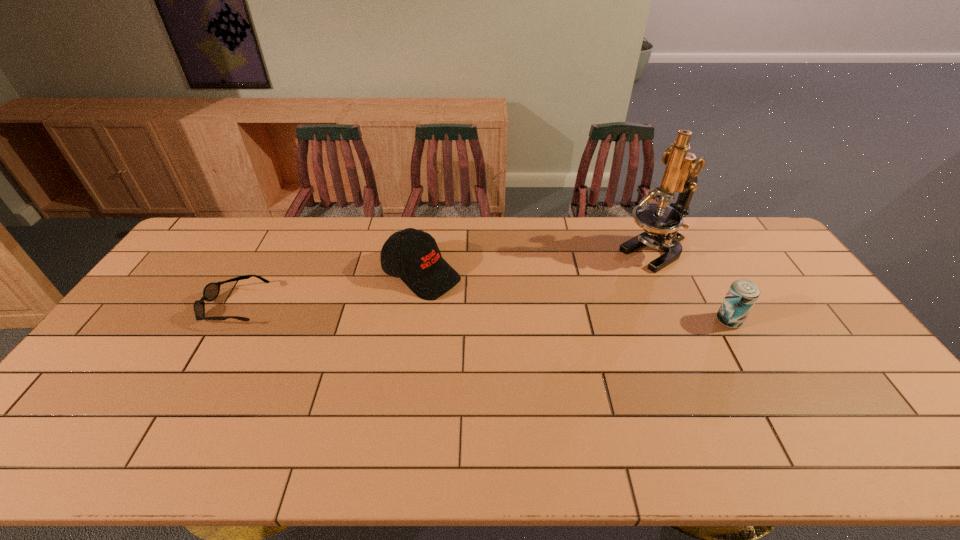
Identify the location of sunglasses. This screenshot has width=960, height=540. coord(211,291).

Locate an element on the screen. the shortest object is located at coordinates (211, 291).

Locate an element on the screen. This screenshot has width=960, height=540. beer can is located at coordinates (742, 294).

In order to click on baseball cap in this screenshot , I will do `click(425, 272)`.

Where is `microscope`? Image resolution: width=960 pixels, height=540 pixels. microscope is located at coordinates (660, 222).

The image size is (960, 540). Find the location of `vacant space located 0.200m on the lenses of the leftmost object`. vacant space located 0.200m on the lenses of the leftmost object is located at coordinates (139, 308).

Where is `vacant space located 0.200m on the lenses of the leftmost object`? The width and height of the screenshot is (960, 540). vacant space located 0.200m on the lenses of the leftmost object is located at coordinates (139, 308).

What are the coordinates of `vacant space located 0.140m on the left of the beer can` in the screenshot? It's located at (668, 321).

Where is `free space located on the front-facing side of the second object from left to right`? The height and width of the screenshot is (540, 960). free space located on the front-facing side of the second object from left to right is located at coordinates (529, 334).

Identify the location of vacant space located 0.190m on the front-facing side of the second object from left to right. (500, 318).